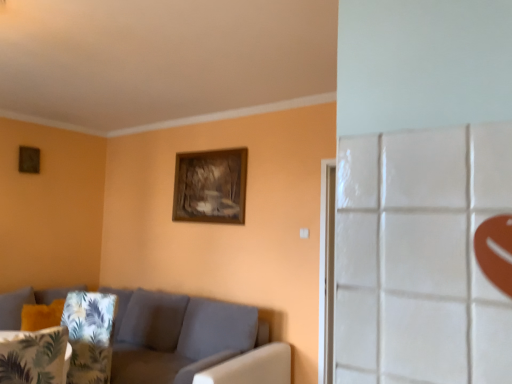
Question: Does wooden frame at upper center have a smaller size compared to green leafy fabric pillow at lower left?

Choices:
 (A) no
 (B) yes

Answer: (B)

Question: From the image's perspective, is wooden frame at upper center on top of green leafy fabric pillow at lower left?

Choices:
 (A) yes
 (B) no

Answer: (A)

Question: Can you confirm if wooden frame at upper center is positioned to the left of green leafy fabric pillow at lower left?

Choices:
 (A) yes
 (B) no

Answer: (B)

Question: From a real-world perspective, is wooden frame at upper center physically below green leafy fabric pillow at lower left?

Choices:
 (A) no
 (B) yes

Answer: (A)

Question: From a real-world perspective, is wooden frame at upper center on top of green leafy fabric pillow at lower left?

Choices:
 (A) no
 (B) yes

Answer: (B)

Question: Considering the positions of wooden frame at upper center and fabric couch at lower left in the image, is wooden frame at upper center taller or shorter than fabric couch at lower left?

Choices:
 (A) tall
 (B) short

Answer: (B)

Question: Considering the positions of point (197, 198) and point (132, 322), is point (197, 198) closer or farther from the camera than point (132, 322)?

Choices:
 (A) closer
 (B) farther

Answer: (B)

Question: In the image, is wooden frame at upper center on the left side or the right side of fabric couch at lower left?

Choices:
 (A) right
 (B) left

Answer: (A)

Question: Choose the correct answer: Is wooden frame at upper center inside fabric couch at lower left or outside it?

Choices:
 (A) inside
 (B) outside

Answer: (B)

Question: Is fabric couch at lower left taller or shorter than wooden frame at upper center?

Choices:
 (A) tall
 (B) short

Answer: (A)

Question: Considering the positions of fabric couch at lower left and wooden frame at upper center in the image, is fabric couch at lower left wider or thinner than wooden frame at upper center?

Choices:
 (A) thin
 (B) wide

Answer: (B)

Question: Considering the positions of fabric couch at lower left and wooden frame at upper center in the image, is fabric couch at lower left bigger or smaller than wooden frame at upper center?

Choices:
 (A) big
 (B) small

Answer: (A)

Question: From a real-world perspective, is fabric couch at lower left above or below wooden frame at upper center?

Choices:
 (A) below
 (B) above

Answer: (A)

Question: In the image, is wooden frame at upper center on the left side or the right side of green leafy fabric pillow at lower left?

Choices:
 (A) right
 (B) left

Answer: (A)

Question: From a real-world perspective, is wooden frame at upper center physically located above or below green leafy fabric pillow at lower left?

Choices:
 (A) above
 (B) below

Answer: (A)